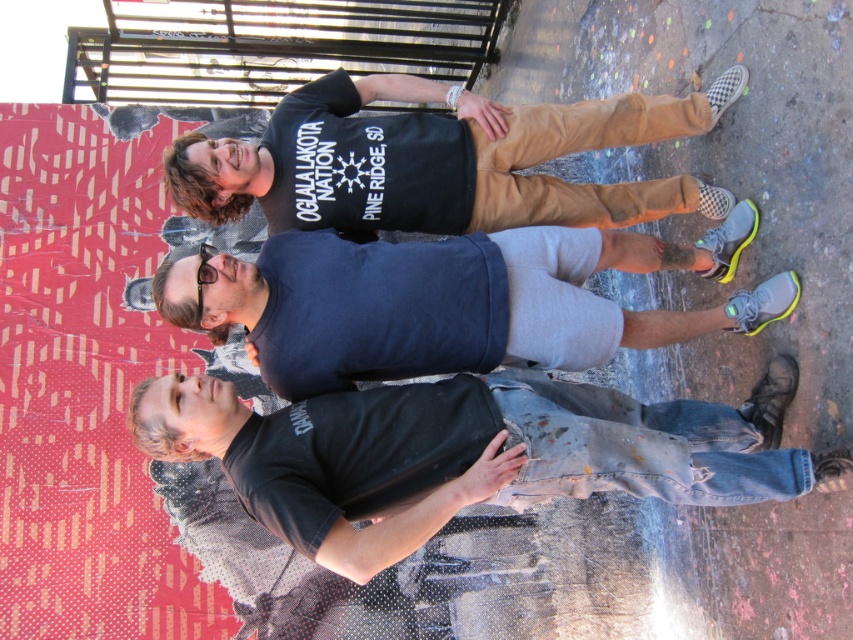
Does black matte skateboard at lower center appear over black cotton t-shirt at upper center?

No, black matte skateboard at lower center is not above black cotton t-shirt at upper center.

Is black matte skateboard at lower center below black cotton t-shirt at upper center?

Yes.

Does point (496, 472) come closer to viewer compared to point (380, 83)?

Yes, it is in front of point (380, 83).

Where is `black matte skateboard at lower center`? The image size is (853, 640). black matte skateboard at lower center is located at coordinates (457, 452).

Consider the image. Between black matte skateboard at lower center and dark blue t-shirt at center, which one has less height?

With less height is black matte skateboard at lower center.

Is black matte skateboard at lower center above dark blue t-shirt at center?

Actually, black matte skateboard at lower center is below dark blue t-shirt at center.

Where is `black matte skateboard at lower center`? black matte skateboard at lower center is located at coordinates (457, 452).

The height and width of the screenshot is (640, 853). Identify the location of black matte skateboard at lower center. (457, 452).

Can you confirm if dark blue t-shirt at center is smaller than black cotton t-shirt at upper center?

Incorrect, dark blue t-shirt at center is not smaller in size than black cotton t-shirt at upper center.

Is the position of dark blue t-shirt at center less distant than that of black cotton t-shirt at upper center?

Yes, dark blue t-shirt at center is in front of black cotton t-shirt at upper center.

Does point (589, 260) come in front of point (183, 176)?

No, (589, 260) is behind (183, 176).

The image size is (853, 640). I want to click on dark blue t-shirt at center, so click(438, 304).